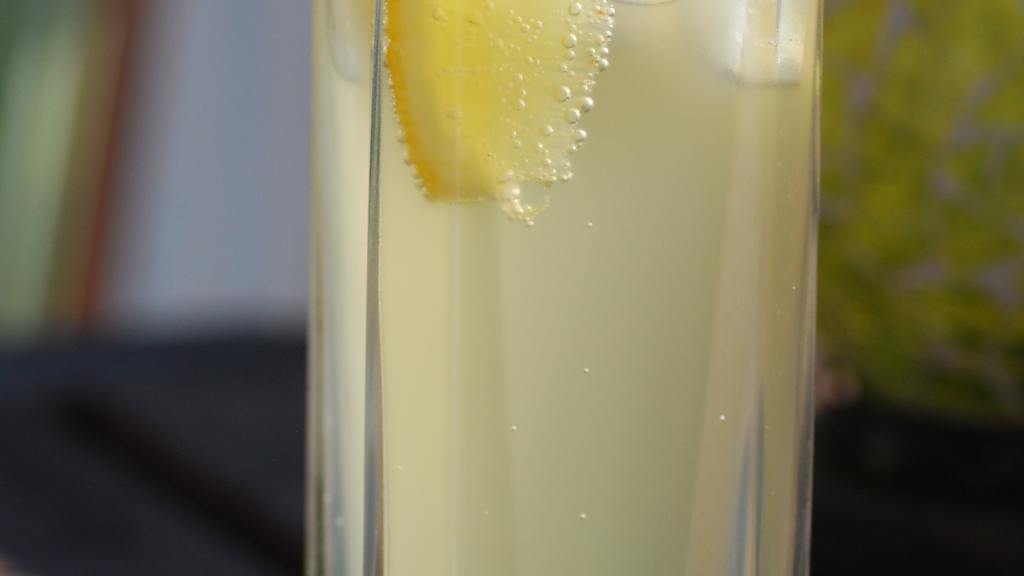
Where is `glass`? glass is located at coordinates (447, 69).